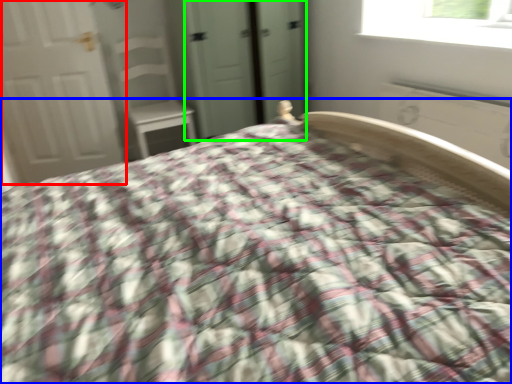
Question: Which is farther away from door (highlighted by a red box)? bed (highlighted by a blue box) or screen door (highlighted by a green box)?

Choices:
 (A) bed
 (B) screen door

Answer: (A)